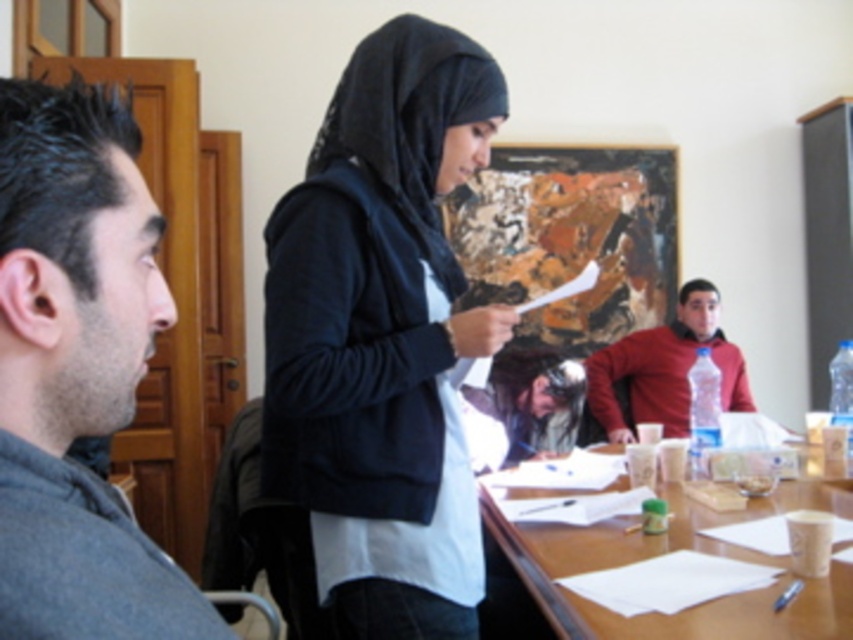
You are standing at the origin point of the coordinate system in the classroom. You need to walk to the wooden table at center. Which direction should you move in to reach it?

The wooden table at center is located at coordinate point (662, 554), so you should move in the direction of increasing both x and y coordinates to reach it.

You are organizing a photo shoot and need to ensure that the black matte hijab at center and the dark gray shirt at left are visible in the frame. Which object requires a wider camera angle to capture its full width?

The black matte hijab at center requires a wider camera angle because its width surpasses that of the dark gray shirt at left.

You are a photographer taking a picture of the scene. You have two points marked in the image at coordinates point (x=146, y=554) and point (x=491, y=573). Which of these points is closer to the camera?

Point (x=146, y=554) is closer to the viewer than point (x=491, y=573).